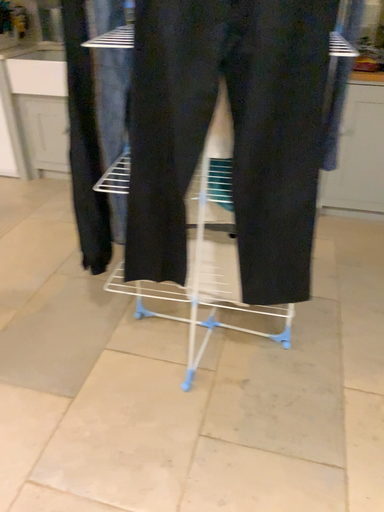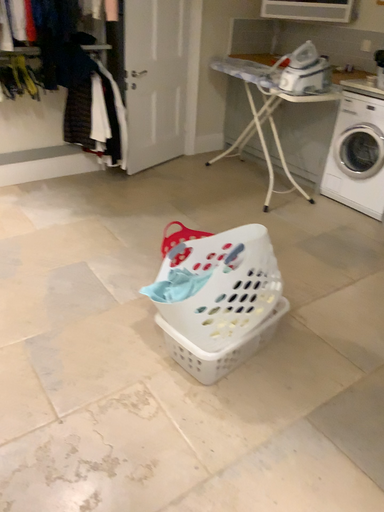
Question: Which way did the camera rotate in the video?

Choices:
 (A) rotated downward
 (B) rotated upward

Answer: (B)